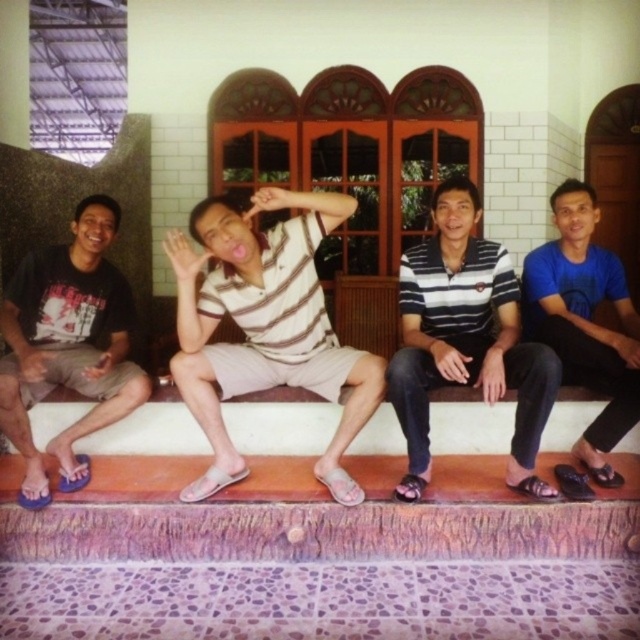
Question: Considering the real-world distances, which object is closest to the striped polo shirt at center?

Choices:
 (A) striped cotton shirt at center
 (B) blue fabric shirt at right

Answer: (B)

Question: Does striped cotton shirt at center have a greater width compared to striped polo shirt at center?

Choices:
 (A) yes
 (B) no

Answer: (A)

Question: Which of the following is the farthest from the observer?

Choices:
 (A) striped cotton shirt at center
 (B) striped polo shirt at center
 (C) matte black shirt at left

Answer: (C)

Question: Which of the following is the closest to the observer?

Choices:
 (A) blue fabric shirt at right
 (B) matte black shirt at left
 (C) striped polo shirt at center
 (D) striped cotton shirt at center

Answer: (C)

Question: Is the position of matte black shirt at left less distant than that of blue fabric shirt at right?

Choices:
 (A) no
 (B) yes

Answer: (A)

Question: Is matte black shirt at left wider than blue fabric shirt at right?

Choices:
 (A) no
 (B) yes

Answer: (B)